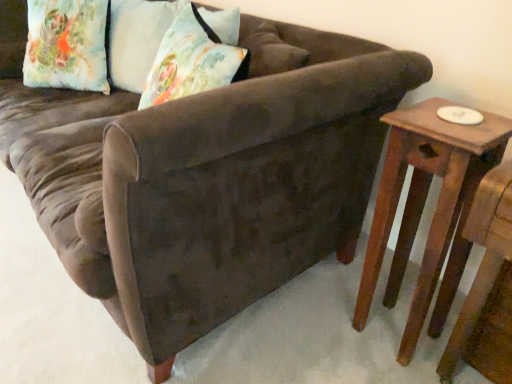
What is the approximate height of floral fabric pillow at upper left, which is the 2th pillow in left-to-right order?

It is 10.66 inches.

Find the location of `floral fabric pillow at upper left, which is counted as the 1th pillow, starting from the right`. floral fabric pillow at upper left, which is counted as the 1th pillow, starting from the right is located at coordinates (136, 36).

Is wooden side table at right touching floral fabric pillow at upper left, which is counted as the 1th pillow, starting from the right?

No, wooden side table at right is not making contact with floral fabric pillow at upper left, which is counted as the 1th pillow, starting from the right.

From a real-world perspective, which object stands above the other?

In real-world perspective, floral fabric pillow at upper left, which is the 2th pillow in left-to-right order, is above.

Can you confirm if wooden side table at right is wider than floral fabric pillow at upper left, which is counted as the 1th pillow, starting from the right?

In fact, wooden side table at right might be narrower than floral fabric pillow at upper left, which is counted as the 1th pillow, starting from the right.

Is wooden side table at right outside of floral fabric pillow at upper left, which ranks as the first pillow in left-to-right order?

wooden side table at right is positioned outside floral fabric pillow at upper left, which ranks as the first pillow in left-to-right order.

Could you tell me if wooden side table at right is turned towards floral fabric pillow at upper left, which appears as the 2th pillow when viewed from the right?

No, wooden side table at right is not turned towards floral fabric pillow at upper left, which appears as the 2th pillow when viewed from the right.

Is point (489, 147) in front of point (40, 47)?

Yes, point (489, 147) is closer to viewer.

Based on the photo, from the image's perspective, is wooden side table at right on top of floral fabric pillow at upper left, which appears as the 2th pillow when viewed from the right?

No, from the image's perspective, wooden side table at right is not over floral fabric pillow at upper left, which appears as the 2th pillow when viewed from the right.

Which of these two, floral fabric pillow at upper left, which is counted as the 1th pillow, starting from the right, or wooden side table at right, is smaller?

With smaller size is floral fabric pillow at upper left, which is counted as the 1th pillow, starting from the right.

Is floral fabric pillow at upper left, which is the 2th pillow in left-to-right order, oriented towards wooden side table at right?

No, floral fabric pillow at upper left, which is the 2th pillow in left-to-right order, is not turned towards wooden side table at right.

Who is shorter, floral fabric pillow at upper left, which is the 2th pillow in left-to-right order, or wooden side table at right?

floral fabric pillow at upper left, which is the 2th pillow in left-to-right order, is shorter.

Is floral fabric pillow at upper left, which is the 2th pillow in left-to-right order, positioned far away from wooden side table at right?

Yes, floral fabric pillow at upper left, which is the 2th pillow in left-to-right order, and wooden side table at right are located far from each other.

Locate an element on the screen. table in front of the floral fabric pillow at upper left, which appears as the 2th pillow when viewed from the right is located at coordinates (423, 208).

Looking at this image, which of these two, floral fabric pillow at upper left, which ranks as the first pillow in left-to-right order, or wooden side table at right, stands taller?

With more height is wooden side table at right.

Consider the image. From the image's perspective, does floral fabric pillow at upper left, which appears as the 2th pillow when viewed from the right, appear lower than wooden side table at right?

Actually, floral fabric pillow at upper left, which appears as the 2th pillow when viewed from the right, appears above wooden side table at right in the image.

Measure the distance between floral fabric pillow at upper left, which ranks as the first pillow in left-to-right order, and wooden side table at right.

floral fabric pillow at upper left, which ranks as the first pillow in left-to-right order, and wooden side table at right are 1.67 meters apart.

From the image's perspective, is floral fabric pillow at upper left, which is counted as the 1th pillow, starting from the right, below floral fabric pillow at upper left, which ranks as the first pillow in left-to-right order?

Yes.

Is floral fabric pillow at upper left, which is counted as the 1th pillow, starting from the right, bigger or smaller than floral fabric pillow at upper left, which appears as the 2th pillow when viewed from the right?

Considering their sizes, floral fabric pillow at upper left, which is counted as the 1th pillow, starting from the right, takes up less space than floral fabric pillow at upper left, which appears as the 2th pillow when viewed from the right.

From a real-world perspective, is floral fabric pillow at upper left, which is the 2th pillow in left-to-right order, on floral fabric pillow at upper left, which appears as the 2th pillow when viewed from the right?

Yes, from a real-world perspective, floral fabric pillow at upper left, which is the 2th pillow in left-to-right order, is over floral fabric pillow at upper left, which appears as the 2th pillow when viewed from the right

Between floral fabric pillow at upper left, which ranks as the first pillow in left-to-right order, and floral fabric pillow at upper left, which is the 2th pillow in left-to-right order, which one appears on the right side from the viewer's perspective?

floral fabric pillow at upper left, which is the 2th pillow in left-to-right order, is more to the right.

From a real-world perspective, which object rests below the other?

floral fabric pillow at upper left, which appears as the 2th pillow when viewed from the right, from a real-world perspective.

From the picture: From the image's perspective, does floral fabric pillow at upper left, which appears as the 2th pillow when viewed from the right, appear higher than floral fabric pillow at upper left, which is counted as the 1th pillow, starting from the right?

Correct, floral fabric pillow at upper left, which appears as the 2th pillow when viewed from the right, appears higher than floral fabric pillow at upper left, which is counted as the 1th pillow, starting from the right, in the image.

Is point (62, 75) closer to camera compared to point (132, 77)?

That is False.

Find the location of a particular element. The height and width of the screenshot is (384, 512). table in front of the floral fabric pillow at upper left, which is counted as the 1th pillow, starting from the right is located at coordinates (423, 208).

Locate an element on the screen. the 1st pillow positioned above the wooden side table at right (from a real-world perspective) is located at coordinates (67, 45).

Estimate the real-world distances between objects in this image. Which object is closer to floral fabric pillow at upper left, which ranks as the first pillow in left-to-right order, floral fabric pillow at upper left, which is the 2th pillow in left-to-right order, or wooden side table at right?

floral fabric pillow at upper left, which is the 2th pillow in left-to-right order, lies closer to floral fabric pillow at upper left, which ranks as the first pillow in left-to-right order, than the other object.

Which object lies further to the anchor point wooden side table at right, floral fabric pillow at upper left, which is counted as the 1th pillow, starting from the right, or floral fabric pillow at upper left, which appears as the 2th pillow when viewed from the right?

Among the two, floral fabric pillow at upper left, which appears as the 2th pillow when viewed from the right, is located further to wooden side table at right.

From the image, which object appears to be farther from floral fabric pillow at upper left, which is counted as the 1th pillow, starting from the right, wooden side table at right or floral fabric pillow at upper left, which ranks as the first pillow in left-to-right order?

The object further to floral fabric pillow at upper left, which is counted as the 1th pillow, starting from the right, is wooden side table at right.

Looking at the image, which one is located closer to floral fabric pillow at upper left, which appears as the 2th pillow when viewed from the right, wooden side table at right or floral fabric pillow at upper left, which is the 2th pillow in left-to-right order?

The object closer to floral fabric pillow at upper left, which appears as the 2th pillow when viewed from the right, is floral fabric pillow at upper left, which is the 2th pillow in left-to-right order.

Looking at this image, which object lies nearer to the anchor point floral fabric pillow at upper left, which is the 2th pillow in left-to-right order, floral fabric pillow at upper left, which ranks as the first pillow in left-to-right order, or wooden side table at right?

floral fabric pillow at upper left, which ranks as the first pillow in left-to-right order.

Which object lies further to the anchor point wooden side table at right, floral fabric pillow at upper left, which appears as the 2th pillow when viewed from the right, or floral fabric pillow at upper left, which is counted as the 1th pillow, starting from the right?

Based on the image, floral fabric pillow at upper left, which appears as the 2th pillow when viewed from the right, appears to be further to wooden side table at right.

Identify the location of pillow between floral fabric pillow at upper left, which ranks as the first pillow in left-to-right order, and wooden side table at right from left to right. The height and width of the screenshot is (384, 512). (136, 36).